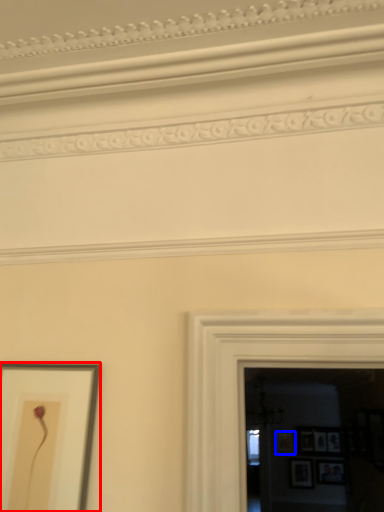
Question: Which object appears farthest to the camera in this image, picture frame (highlighted by a red box) or picture frame (highlighted by a blue box)?

Choices:
 (A) picture frame
 (B) picture frame

Answer: (B)